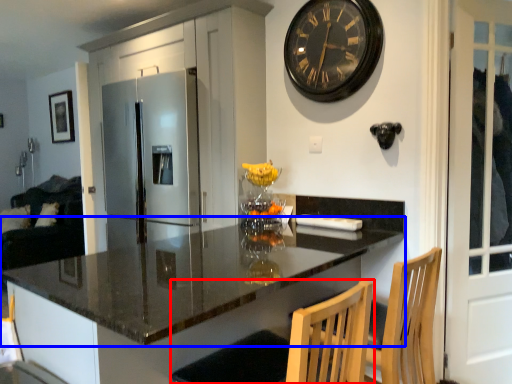
Question: Among these objects, which one is farthest to the camera, swivel chair (highlighted by a red box) or countertop (highlighted by a blue box)?

Choices:
 (A) swivel chair
 (B) countertop

Answer: (A)